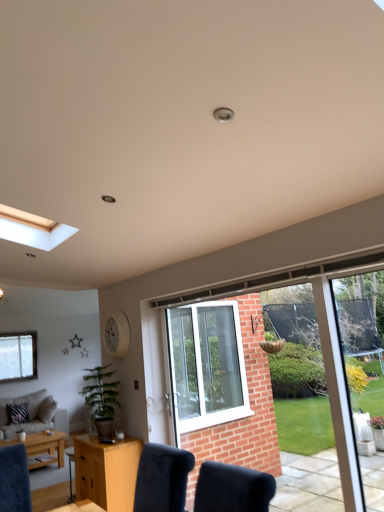
Question: Is clear glass window at lower left, the 2th window from the front, surrounding green leafy plant at lower left?

Choices:
 (A) no
 (B) yes

Answer: (A)

Question: From a real-world perspective, is clear glass window at lower left, the first window positioned from the left, positioned over green leafy plant at lower left based on gravity?

Choices:
 (A) yes
 (B) no

Answer: (A)

Question: Can you confirm if clear glass window at lower left, arranged as the first window when viewed from the back, is wider than green leafy plant at lower left?

Choices:
 (A) no
 (B) yes

Answer: (A)

Question: Considering the relative positions of clear glass window at lower left, arranged as the first window when viewed from the back, and green leafy plant at lower left in the image provided, is clear glass window at lower left, arranged as the first window when viewed from the back, to the right of green leafy plant at lower left from the viewer's perspective?

Choices:
 (A) no
 (B) yes

Answer: (A)

Question: Is clear glass window at lower left, the 2th window from the front, to the left of green leafy plant at lower left from the viewer's perspective?

Choices:
 (A) yes
 (B) no

Answer: (A)

Question: From a real-world perspective, does clear glass window at lower left, arranged as the first window when viewed from the back, sit lower than green leafy plant at lower left?

Choices:
 (A) yes
 (B) no

Answer: (B)

Question: From the image's perspective, is light brown wood desk at lower center on green leafy plant at lower left?

Choices:
 (A) no
 (B) yes

Answer: (A)

Question: Is the position of light brown wood desk at lower center more distant than that of green leafy plant at lower left?

Choices:
 (A) no
 (B) yes

Answer: (A)

Question: Considering the relative sizes of light brown wood desk at lower center and green leafy plant at lower left in the image provided, is light brown wood desk at lower center shorter than green leafy plant at lower left?

Choices:
 (A) yes
 (B) no

Answer: (B)

Question: Is light brown wood desk at lower center surrounding green leafy plant at lower left?

Choices:
 (A) no
 (B) yes

Answer: (A)

Question: From a real-world perspective, is light brown wood desk at lower center under green leafy plant at lower left?

Choices:
 (A) no
 (B) yes

Answer: (B)

Question: Is light brown wood desk at lower center outside green leafy plant at lower left?

Choices:
 (A) no
 (B) yes

Answer: (B)

Question: Is light brown wooden coffee table at lower left wider than clear glass window at lower left, the 2th window from the front?

Choices:
 (A) no
 (B) yes

Answer: (B)